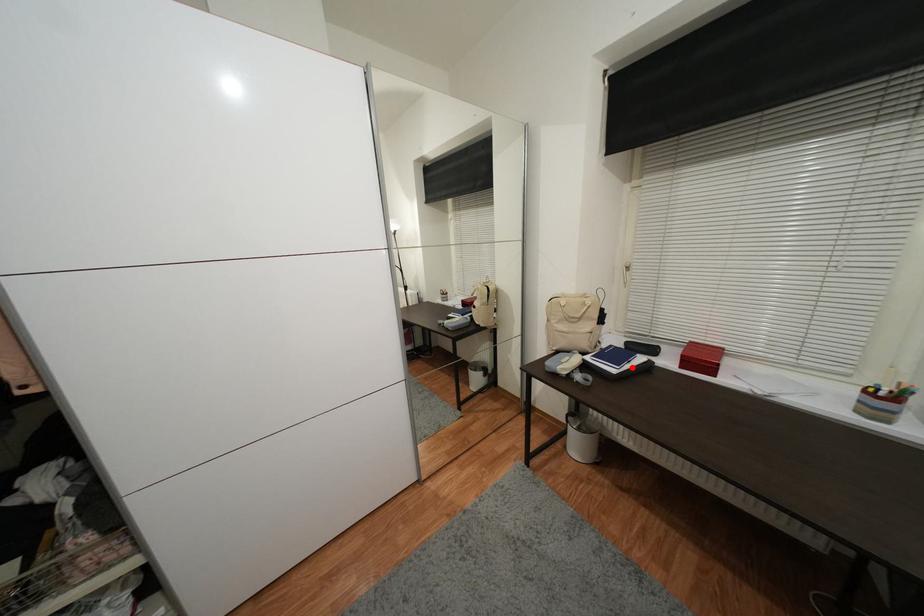
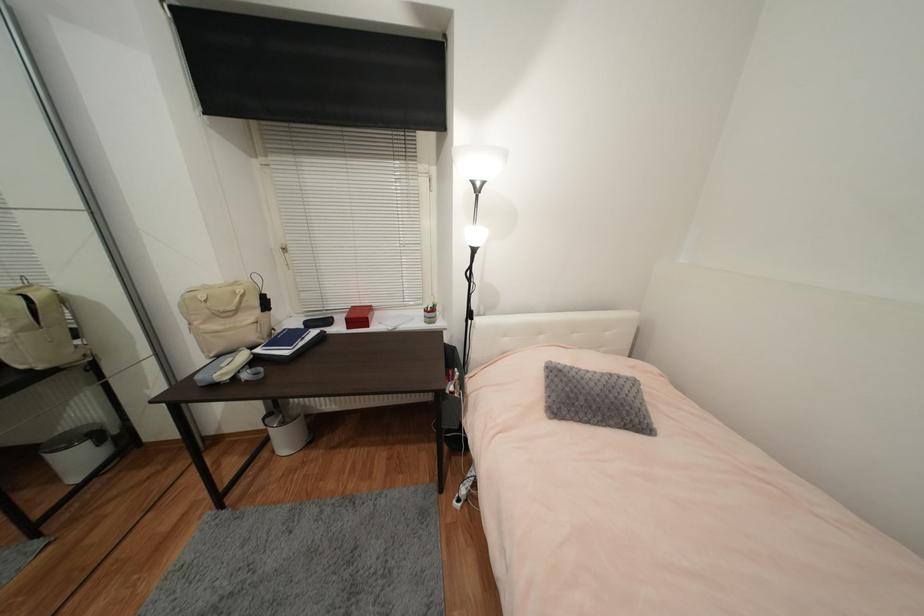
The point at the highlighted location is marked in the first image. Where is the corresponding point in the second image?

(306, 344)